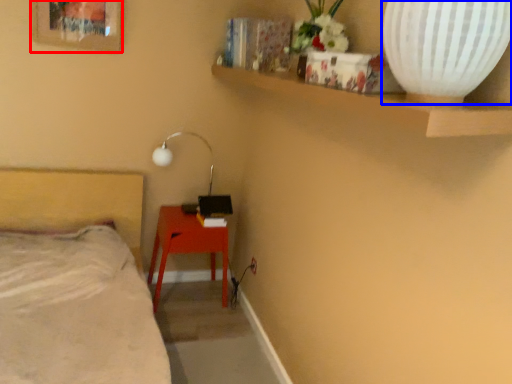
Question: Among these objects, which one is nearest to the camera, picture frame (highlighted by a red box) or vase (highlighted by a blue box)?

Choices:
 (A) picture frame
 (B) vase

Answer: (B)